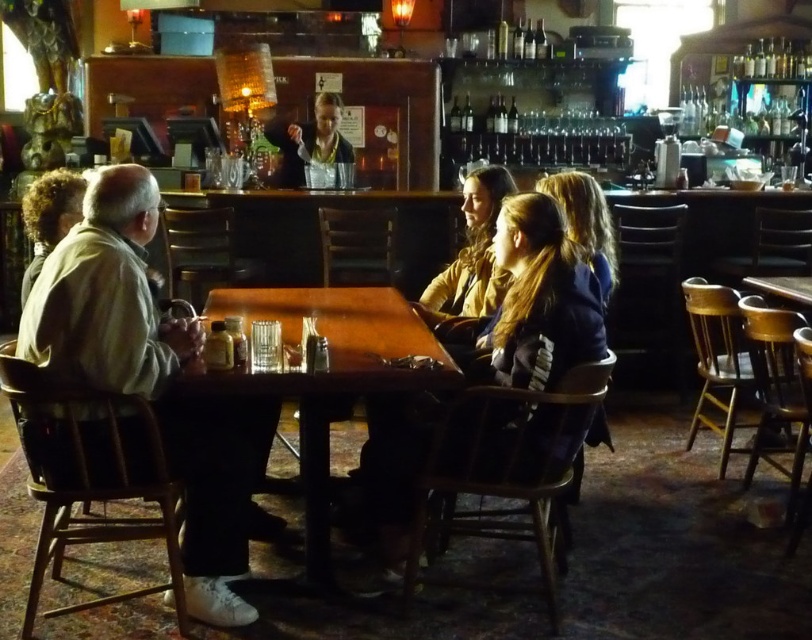
You are standing in the bar and want to reach a specific point to place a drink. The point is located at coordinates point (262, 378). Considering your height is 1.7 meters, can you comfortably place the drink there without needing to stretch?

The distance of point (262, 378) from viewer is 2.06 meters. Since the point is 2.06 meters away and your height is 1.7 meters, you can comfortably reach it without stretching as the horizontal distance is manageable.

Based on the photo, you are a delivery person holding a large pizza box that is 1.8 meters wide. You need to place it on the wooden table at center. Can you fit the pizza box on the table without it overhanging the edges?

The distance between the wooden table at center and the viewer is 2.03 meters, but this measurement does not indicate the table size. Therefore, it is unclear if the pizza box will fit without overhanging the edges.

You are a photographer taking a picture of the light brown leather jacket at left and the curly hair at left. Which object should you focus on first if you want to capture both in the same frame without moving the camera?

The light brown leather jacket at left is taller than curly hair at left, so you should focus on the light brown leather jacket at left first to ensure both are in focus since it is the taller object.